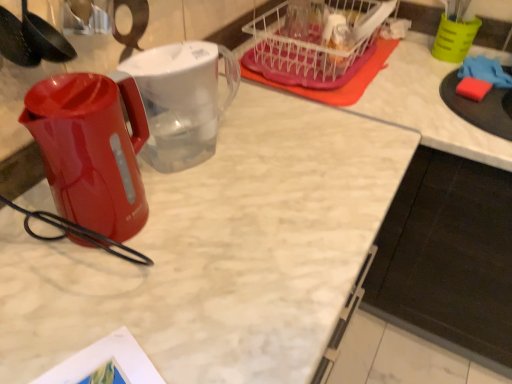
What are the coordinates of `vacant area that lies between transparent plastic pitcher at center and green plastic cup at upper right` in the screenshot? It's located at (349, 104).